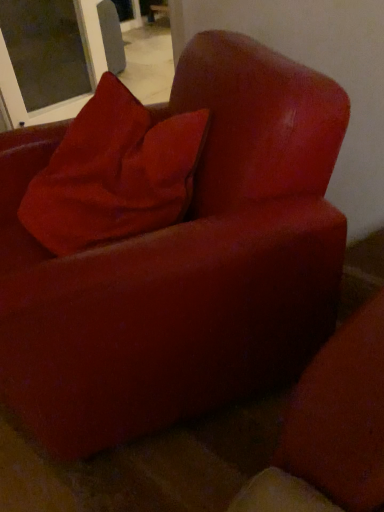
At what (x,y) coordinates should I click in order to perform the action: click on transparent glass screen door at upper left. Please return your answer as a coordinate pair (x, y). Looking at the image, I should click on (45, 50).

The height and width of the screenshot is (512, 384). Describe the element at coordinates (45, 50) in the screenshot. I see `transparent glass screen door at upper left` at that location.

Describe the element at coordinates (114, 174) in the screenshot. I see `velvet red pillow at upper left` at that location.

Locate an element on the screen. The height and width of the screenshot is (512, 384). velvet red pillow at upper left is located at coordinates (114, 174).

The image size is (384, 512). Find the location of `transparent glass screen door at upper left`. transparent glass screen door at upper left is located at coordinates (45, 50).

Does transparent glass screen door at upper left appear on the left side of velvet red pillow at upper left?

Indeed, transparent glass screen door at upper left is positioned on the left side of velvet red pillow at upper left.

Does transparent glass screen door at upper left lie in front of velvet red pillow at upper left?

No, transparent glass screen door at upper left is further to the viewer.

Does point (18, 64) lie in front of point (95, 178)?

No.

From the image's perspective, is transparent glass screen door at upper left beneath velvet red pillow at upper left?

Incorrect, from the image's perspective, transparent glass screen door at upper left is higher than velvet red pillow at upper left.

From a real-world perspective, which object stands above the other?

From a 3D spatial view, velvet red pillow at upper left is above.

Which of these two, transparent glass screen door at upper left or velvet red pillow at upper left, is wider?

Wider between the two is transparent glass screen door at upper left.

Which of these two, transparent glass screen door at upper left or velvet red pillow at upper left, stands taller?

With more height is transparent glass screen door at upper left.

Which of these two, transparent glass screen door at upper left or velvet red pillow at upper left, is bigger?

transparent glass screen door at upper left is bigger.

Is transparent glass screen door at upper left inside the boundaries of velvet red pillow at upper left, or outside?

transparent glass screen door at upper left is spatially situated outside velvet red pillow at upper left.

Is transparent glass screen door at upper left not near velvet red pillow at upper left?

Yes.

Is transparent glass screen door at upper left aimed at velvet red pillow at upper left?

No, transparent glass screen door at upper left is not turned towards velvet red pillow at upper left.

What's the angular difference between transparent glass screen door at upper left and velvet red pillow at upper left's facing directions?

They differ by 131 degrees in their facing directions.

Identify the location of screen door to the left of velvet red pillow at upper left. (45, 50).

Can you confirm if velvet red pillow at upper left is positioned to the right of transparent glass screen door at upper left?

Indeed, velvet red pillow at upper left is positioned on the right side of transparent glass screen door at upper left.

Which object is further away from the camera taking this photo, velvet red pillow at upper left or transparent glass screen door at upper left?

transparent glass screen door at upper left is further from the camera.

Which point is more distant from viewer, [153,141] or [12,63]?

The point [12,63] is farther from the camera.

From the image's perspective, does velvet red pillow at upper left appear lower than transparent glass screen door at upper left?

Yes.

Looking at this image, from a real-world perspective, which is physically above, velvet red pillow at upper left or transparent glass screen door at upper left?

In real-world perspective, velvet red pillow at upper left is above.

Does velvet red pillow at upper left have a lesser width compared to transparent glass screen door at upper left?

Correct, the width of velvet red pillow at upper left is less than that of transparent glass screen door at upper left.

Does velvet red pillow at upper left have a greater height compared to transparent glass screen door at upper left?

No, velvet red pillow at upper left is not taller than transparent glass screen door at upper left.

From the picture: Looking at the image, does velvet red pillow at upper left seem bigger or smaller compared to transparent glass screen door at upper left?

In the image, velvet red pillow at upper left appears to be smaller than transparent glass screen door at upper left.

Based on the photo, is velvet red pillow at upper left not inside transparent glass screen door at upper left?

Yes, velvet red pillow at upper left is located beyond the bounds of transparent glass screen door at upper left.

Is velvet red pillow at upper left not close to transparent glass screen door at upper left?

Yes.

Is velvet red pillow at upper left looking in the opposite direction of transparent glass screen door at upper left?

No, velvet red pillow at upper left's orientation is not away from transparent glass screen door at upper left.

In the image, there is a velvet red pillow at upper left. At what (x,y) coordinates should I click in order to perform the action: click on screen door above it (from the image's perspective). Please return your answer as a coordinate pair (x, y). The width and height of the screenshot is (384, 512). Looking at the image, I should click on (45, 50).

This screenshot has width=384, height=512. I want to click on screen door on the left of velvet red pillow at upper left, so click(x=45, y=50).

Identify the location of pillow below the transparent glass screen door at upper left (from the image's perspective). The height and width of the screenshot is (512, 384). (114, 174).